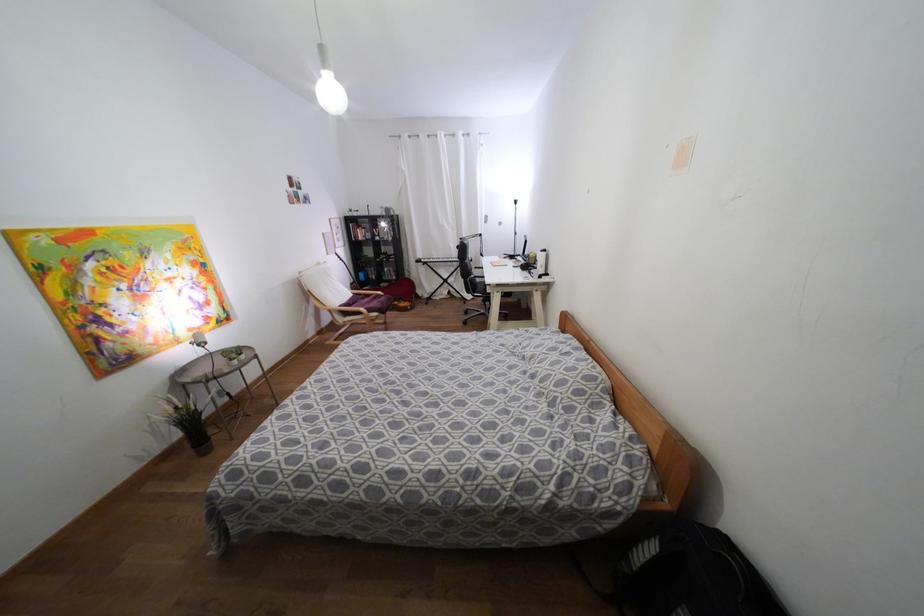
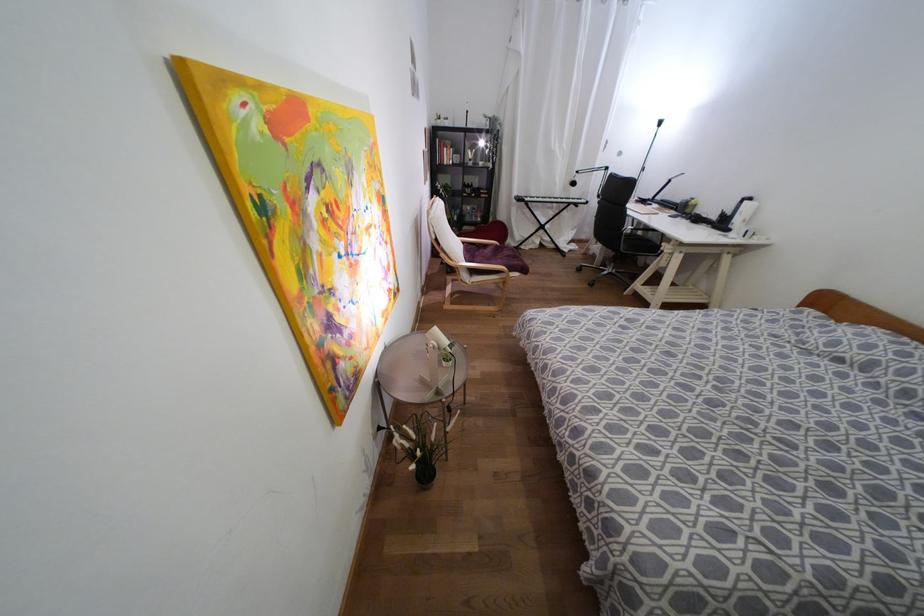
The point at (x=543, y=249) is marked in the first image. Where is the corresponding point in the second image?

(749, 198)